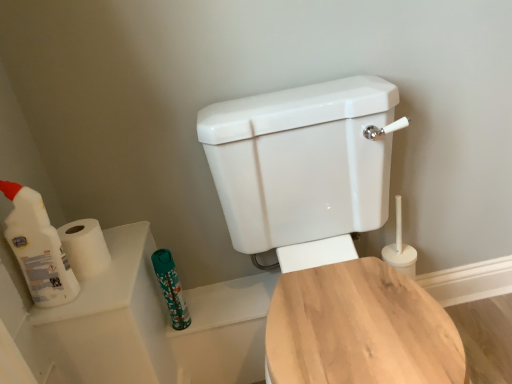
I want to click on teal fabric toiletry at lower center, so click(x=170, y=288).

The image size is (512, 384). What do you see at coordinates (85, 247) in the screenshot?
I see `white matte toilet paper at left` at bounding box center [85, 247].

You are a GUI agent. You are given a task and a screenshot of the screen. Output one action in this format:
    pyautogui.click(x=<x>, y=<y>)
    Task: Click on the teal fabric toiletry at lower center
    
    Given the screenshot: What is the action you would take?
    pyautogui.click(x=170, y=288)

From a real-world perspective, does wooden toilet seat at center, arranged as the 1th toilet when viewed from the back, stand above teal fabric toiletry at lower center?

Incorrect, from a real-world perspective, wooden toilet seat at center, arranged as the 1th toilet when viewed from the back, is lower than teal fabric toiletry at lower center.

Does wooden toilet seat at center, which is the second toilet in front-to-back order, have a greater height compared to teal fabric toiletry at lower center?

In fact, wooden toilet seat at center, which is the second toilet in front-to-back order, may be shorter than teal fabric toiletry at lower center.

Looking at this image, is wooden toilet seat at center, arranged as the 1th toilet when viewed from the back, positioned beyond the bounds of teal fabric toiletry at lower center?

Indeed, wooden toilet seat at center, arranged as the 1th toilet when viewed from the back, is completely outside teal fabric toiletry at lower center.

Between wooden toilet seat at center, arranged as the 1th toilet when viewed from the back, and teal fabric toiletry at lower center, which one has larger width?

wooden toilet seat at center, arranged as the 1th toilet when viewed from the back, is wider.

Is white matte toilet paper at left not inside white plastic bottle at left?

white matte toilet paper at left is positioned outside white plastic bottle at left.

Considering the relative positions of white matte toilet paper at left and white plastic bottle at left in the image provided, is white matte toilet paper at left to the left or to the right of white plastic bottle at left?

white matte toilet paper at left is to the right of white plastic bottle at left.

Which is behind, point (106, 248) or point (13, 228)?

The point (106, 248) is farther from the camera.

Could you tell me if white matte toilet paper at left is turned towards white plastic bottle at left?

No, white matte toilet paper at left is not aimed at white plastic bottle at left.

Does wooden toilet seat at center, arranged as the 1th toilet when viewed from the back, have a greater height compared to white matte toilet paper at left?

No.

Looking at this image, is wooden toilet seat at center, arranged as the 1th toilet when viewed from the back, closer to the viewer compared to white matte toilet paper at left?

No, wooden toilet seat at center, arranged as the 1th toilet when viewed from the back, is behind white matte toilet paper at left.

Considering the relative positions of wooden toilet seat at center, arranged as the 1th toilet when viewed from the back, and white matte toilet paper at left in the image provided, is wooden toilet seat at center, arranged as the 1th toilet when viewed from the back, to the left of white matte toilet paper at left from the viewer's perspective?

In fact, wooden toilet seat at center, arranged as the 1th toilet when viewed from the back, is to the right of white matte toilet paper at left.

Is white plastic bottle at left completely or partially outside of white matte toilet paper at left?

Yes.

Is white plastic bottle at left to the right of white matte toilet paper at left from the viewer's perspective?

No, white plastic bottle at left is not to the right of white matte toilet paper at left.

From the picture: Which is less distant, (x=25, y=268) or (x=87, y=231)?

The point (x=25, y=268) is more forward.

Considering the sizes of objects white plastic bottle at left and white matte toilet paper at left in the image provided, who is shorter, white plastic bottle at left or white matte toilet paper at left?

Standing shorter between the two is white matte toilet paper at left.

From the picture: Which of these two, wooden toilet seat at center, which is the second toilet in front-to-back order, or white glossy toilet at center, placed as the 2th toilet when sorted from back to front, is wider?

wooden toilet seat at center, which is the second toilet in front-to-back order, is wider.

In the scene shown: Which is correct: wooden toilet seat at center, which is the second toilet in front-to-back order, is inside white glossy toilet at center, acting as the 1th toilet starting from the front, or outside of it?

wooden toilet seat at center, which is the second toilet in front-to-back order, lies outside white glossy toilet at center, acting as the 1th toilet starting from the front.

Is wooden toilet seat at center, which is the second toilet in front-to-back order, directly adjacent to white glossy toilet at center, acting as the 1th toilet starting from the front?

Indeed, wooden toilet seat at center, which is the second toilet in front-to-back order, and white glossy toilet at center, acting as the 1th toilet starting from the front, are beside each other and touching.

From the image's perspective, does teal fabric toiletry at lower center appear higher than white glossy toilet at center, acting as the 1th toilet starting from the front?

Actually, teal fabric toiletry at lower center appears below white glossy toilet at center, acting as the 1th toilet starting from the front, in the image.

Based on the photo, can you confirm if teal fabric toiletry at lower center is wider than white glossy toilet at center, acting as the 1th toilet starting from the front?

In fact, teal fabric toiletry at lower center might be narrower than white glossy toilet at center, acting as the 1th toilet starting from the front.

Where is `toiletry that appears below the white glossy toilet at center, acting as the 1th toilet starting from the front (from the image's perspective)`? This screenshot has height=384, width=512. toiletry that appears below the white glossy toilet at center, acting as the 1th toilet starting from the front (from the image's perspective) is located at coordinates (170, 288).

Does wooden toilet seat at center, arranged as the 1th toilet when viewed from the back, appear on the left side of white plastic bottle at left?

No, wooden toilet seat at center, arranged as the 1th toilet when viewed from the back, is not to the left of white plastic bottle at left.

From the image's perspective, is wooden toilet seat at center, which is the second toilet in front-to-back order, below white plastic bottle at left?

Indeed, from the image's perspective, wooden toilet seat at center, which is the second toilet in front-to-back order, is shown beneath white plastic bottle at left.

At what (x,y) coordinates should I click in order to perform the action: click on cleaning product in front of the wooden toilet seat at center, which is the second toilet in front-to-back order. Please return your answer as a coordinate pair (x, y). Looking at the image, I should click on (38, 248).

How many degrees apart are the facing directions of wooden toilet seat at center, arranged as the 1th toilet when viewed from the back, and white plastic bottle at left?

180 degrees.

You are a GUI agent. You are given a task and a screenshot of the screen. Output one action in this format:
    pyautogui.click(x=<x>, y=<y>)
    Task: Click on the toiletry that is above the wooden toilet seat at center, arranged as the 1th toilet when viewed from the back (from the image's perspective)
    The height and width of the screenshot is (384, 512).
    Given the screenshot: What is the action you would take?
    pyautogui.click(x=170, y=288)

You are a GUI agent. You are given a task and a screenshot of the screen. Output one action in this format:
    pyautogui.click(x=<x>, y=<y>)
    Task: Click on the toilet paper that appears below the white plastic bottle at left (from a real-world perspective)
    The width and height of the screenshot is (512, 384).
    Given the screenshot: What is the action you would take?
    pyautogui.click(x=85, y=247)

When comparing their distances from white glossy toilet at center, placed as the 2th toilet when sorted from back to front, does wooden toilet seat at center, which is the second toilet in front-to-back order, or white plastic bottle at left seem closer?

Among the two, wooden toilet seat at center, which is the second toilet in front-to-back order, is located nearer to white glossy toilet at center, placed as the 2th toilet when sorted from back to front.

From the image, which object appears to be nearer to white glossy toilet at center, placed as the 2th toilet when sorted from back to front, white plastic bottle at left or teal fabric toiletry at lower center?

The object closer to white glossy toilet at center, placed as the 2th toilet when sorted from back to front, is teal fabric toiletry at lower center.

Looking at the image, which one is located further to white plastic bottle at left, wooden toilet seat at center, arranged as the 1th toilet when viewed from the back, or teal fabric toiletry at lower center?

wooden toilet seat at center, arranged as the 1th toilet when viewed from the back.

From the image, which object appears to be farther from white plastic bottle at left, teal fabric toiletry at lower center or white glossy toilet at center, placed as the 2th toilet when sorted from back to front?

The object further to white plastic bottle at left is white glossy toilet at center, placed as the 2th toilet when sorted from back to front.

From the image, which object appears to be nearer to white plastic bottle at left, teal fabric toiletry at lower center or wooden toilet seat at center, arranged as the 1th toilet when viewed from the back?

Based on the image, teal fabric toiletry at lower center appears to be nearer to white plastic bottle at left.

Looking at this image, from the image, which object appears to be nearer to wooden toilet seat at center, which is the second toilet in front-to-back order, white glossy toilet at center, acting as the 1th toilet starting from the front, or white plastic bottle at left?

white glossy toilet at center, acting as the 1th toilet starting from the front, lies closer to wooden toilet seat at center, which is the second toilet in front-to-back order, than the other object.

Based on their spatial positions, is white matte toilet paper at left or teal fabric toiletry at lower center closer to white plastic bottle at left?

white matte toilet paper at left.

Consider the image. Based on their spatial positions, is white plastic bottle at left or white glossy toilet at center, acting as the 1th toilet starting from the front, closer to white matte toilet paper at left?

white plastic bottle at left is closer to white matte toilet paper at left.

Locate an element on the screen. This screenshot has height=384, width=512. toilet paper between white plastic bottle at left and wooden toilet seat at center, which is the second toilet in front-to-back order, in the horizontal direction is located at coordinates (85, 247).

Where is `toiletry between white glossy toilet at center, acting as the 1th toilet starting from the front, and wooden toilet seat at center, which is the second toilet in front-to-back order, along the z-axis`? This screenshot has width=512, height=384. toiletry between white glossy toilet at center, acting as the 1th toilet starting from the front, and wooden toilet seat at center, which is the second toilet in front-to-back order, along the z-axis is located at coordinates (170, 288).

Locate an element on the screen. Image resolution: width=512 pixels, height=384 pixels. toiletry between white plastic bottle at left and wooden toilet seat at center, arranged as the 1th toilet when viewed from the back, in the horizontal direction is located at coordinates (170, 288).

You are a GUI agent. You are given a task and a screenshot of the screen. Output one action in this format:
    pyautogui.click(x=<x>, y=<y>)
    Task: Click on the toilet paper between white plastic bottle at left and teal fabric toiletry at lower center along the z-axis
    
    Given the screenshot: What is the action you would take?
    pyautogui.click(x=85, y=247)